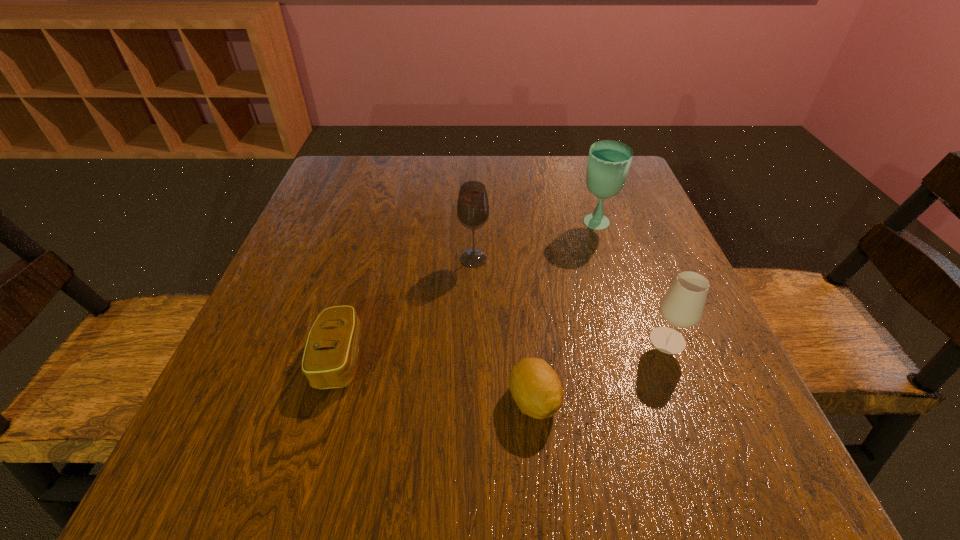
Find the location of a particular element. the farthest object is located at coordinates pyautogui.click(x=608, y=164).

This screenshot has width=960, height=540. In order to click on the second farthest glass in this screenshot , I will do `click(473, 206)`.

This screenshot has height=540, width=960. Identify the location of the second farthest object. (473, 206).

Find the location of `the shortest glass`. the shortest glass is located at coordinates (682, 306).

You are a GUI agent. You are given a task and a screenshot of the screen. Output one action in this format:
    pyautogui.click(x=<x>, y=<y>)
    Task: Click on the third shortest object
    The width and height of the screenshot is (960, 540).
    Given the screenshot: What is the action you would take?
    pyautogui.click(x=682, y=306)

This screenshot has width=960, height=540. Identify the location of lemon. (535, 387).

Find the location of a particular element. clutch bag is located at coordinates (330, 356).

At what (x,y) coordinates should I click in order to perform the action: click on free space located 0.170m on the front of the farthest glass. Please return your answer as a coordinate pair (x, y). Image resolution: width=960 pixels, height=540 pixels. Looking at the image, I should click on coord(617,293).

Locate an element on the screen. This screenshot has height=540, width=960. vacant area situated 0.090m on the back of the leftmost glass is located at coordinates pos(474,224).

Identify the location of vacant space located 0.140m on the left of the nearest glass. (565, 340).